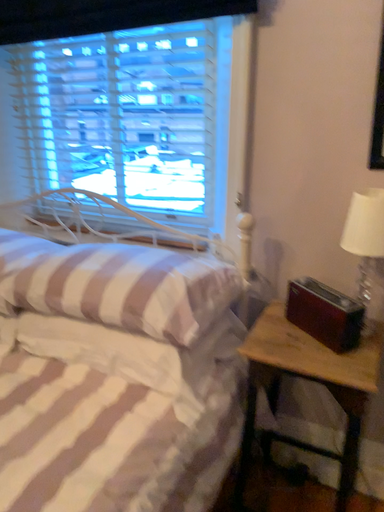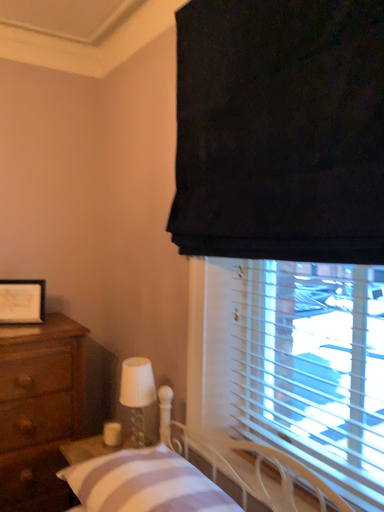
Question: Which way did the camera rotate in the video?

Choices:
 (A) rotated downward
 (B) rotated upward

Answer: (B)